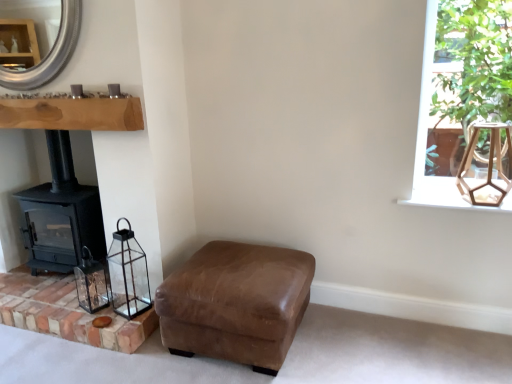
I want to click on vacant space situated above brickroughbrickwork at lower left (from a real-world perspective), so click(57, 292).